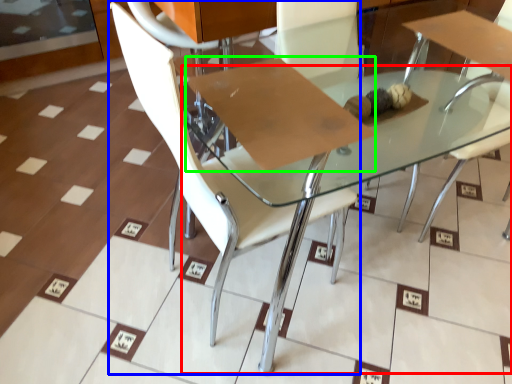
Question: Which is farther away from round table (highlighted by a red box)? chair (highlighted by a blue box) or cardboard (highlighted by a green box)?

Choices:
 (A) chair
 (B) cardboard

Answer: (A)